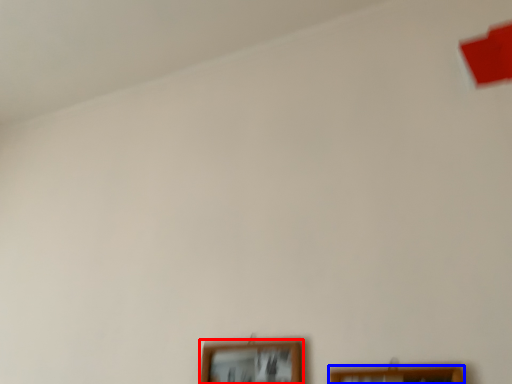
Question: Among these objects, which one is nearest to the camera, picture frame (highlighted by a red box) or picture frame (highlighted by a blue box)?

Choices:
 (A) picture frame
 (B) picture frame

Answer: (B)